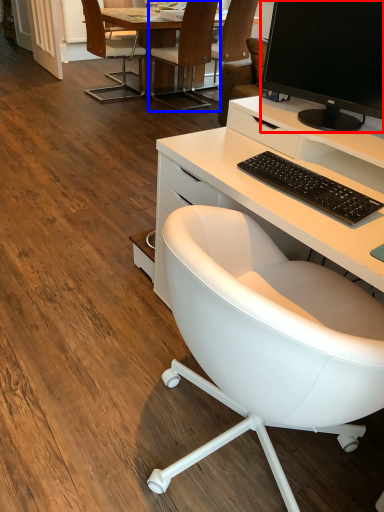
Question: Among these objects, which one is farthest to the camera, television (highlighted by a red box) or chair (highlighted by a blue box)?

Choices:
 (A) television
 (B) chair

Answer: (B)